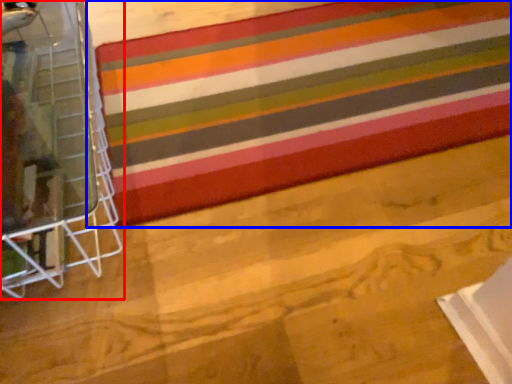
Question: Which object is further to the camera taking this photo, furniture (highlighted by a red box) or quilt (highlighted by a blue box)?

Choices:
 (A) furniture
 (B) quilt

Answer: (B)